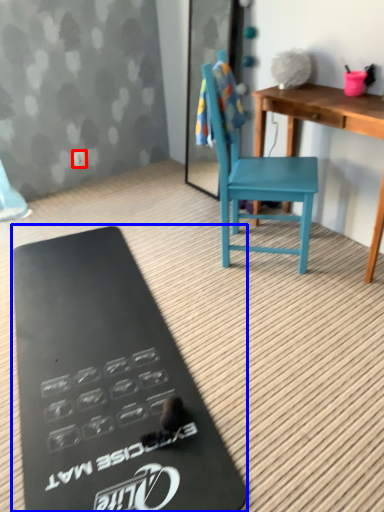
Question: Which object is further to the camera taking this photo, power outlet (highlighted by a red box) or clipboard (highlighted by a blue box)?

Choices:
 (A) power outlet
 (B) clipboard

Answer: (A)